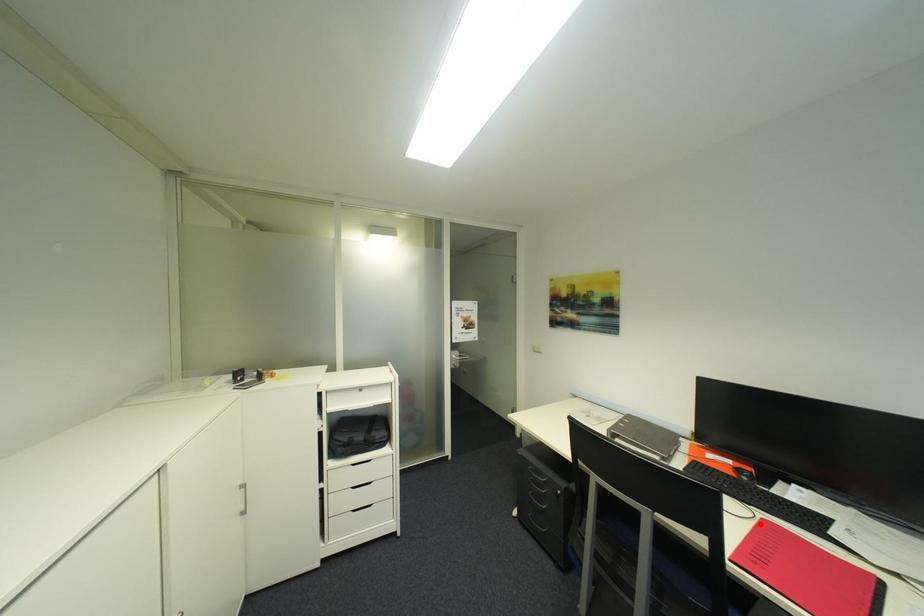
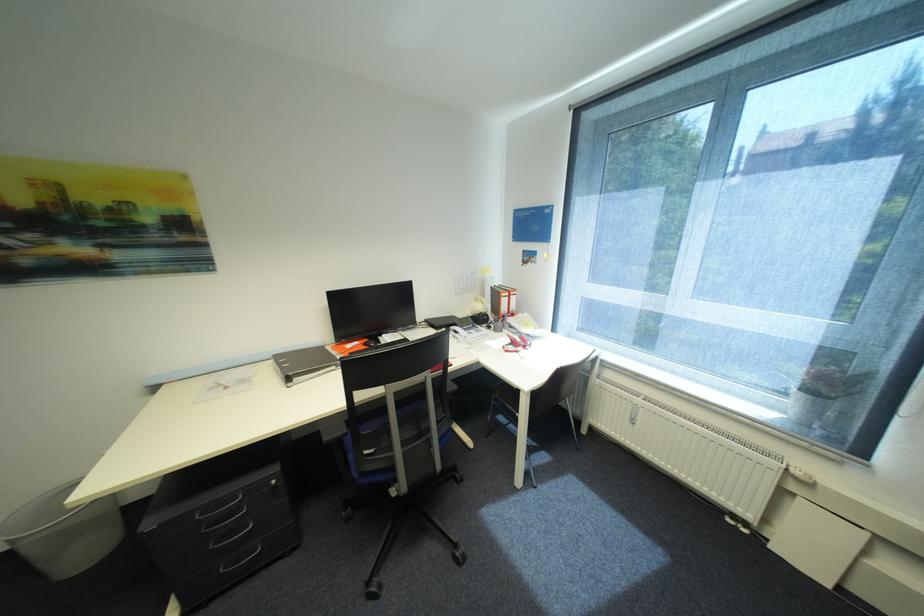
Question: I am providing you with two images of the same scene from different viewpoints. A red point is marked on the first image. Can you still see the location of the red point in image 2?

Choices:
 (A) Yes
 (B) No

Answer: (B)